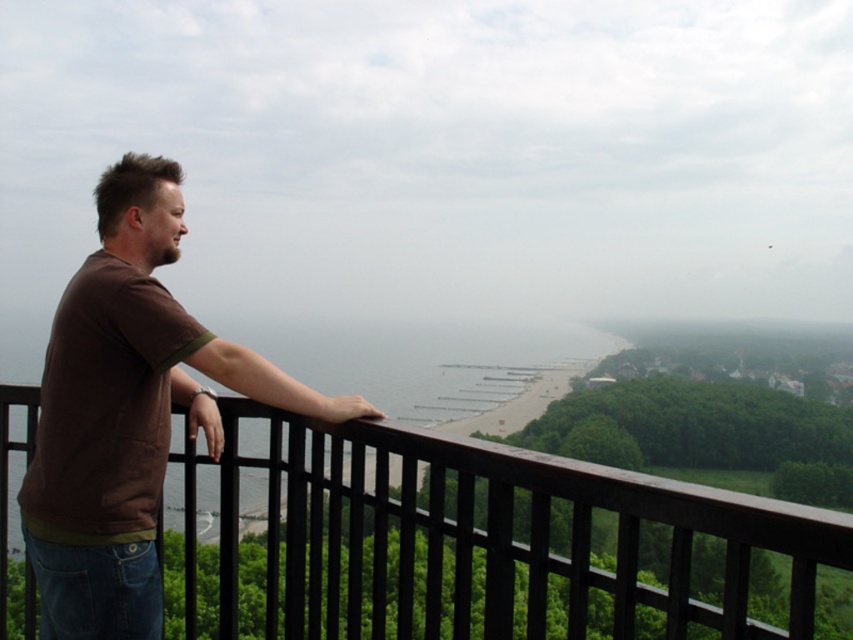
Between brown wood/rail at center and brown cotton t-shirt at left, which one is positioned higher?

brown cotton t-shirt at left is above.

Who is more forward, (454,497) or (144,428)?

Point (454,497) is more forward.

What are the coordinates of `brown wood/rail at center` in the screenshot? It's located at (492, 538).

I want to click on brown wood/rail at center, so click(492, 538).